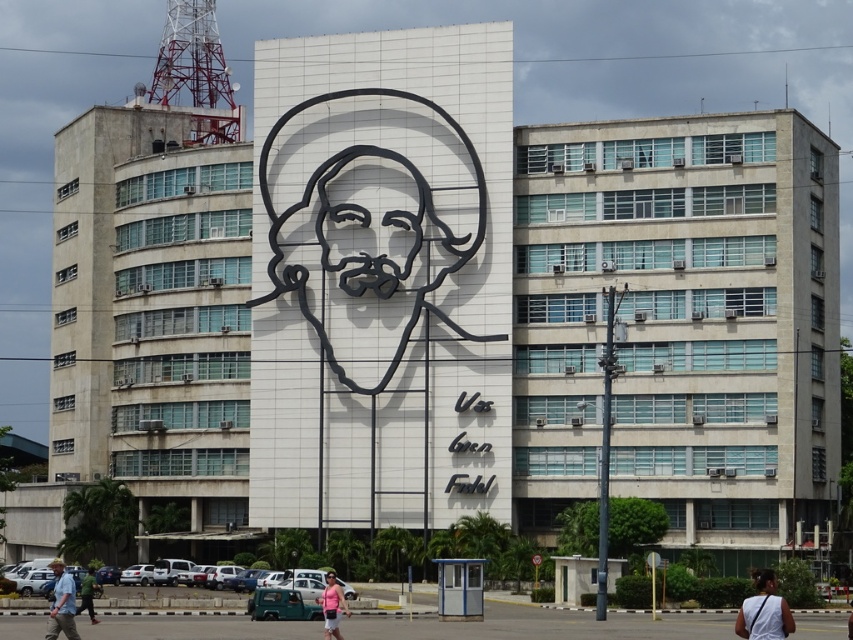
Who is more forward, (370, 266) or (84, 593)?

Point (84, 593) is in front.

Consider the image. Does black wireframe face at center come behind green fabric shirt at lower left?

Yes, it is behind green fabric shirt at lower left.

Which is behind, point (343, 202) or point (93, 618)?

The point (343, 202) is more distant.

Where is `black wireframe face at center`? This screenshot has height=640, width=853. black wireframe face at center is located at coordinates (366, 227).

Who is positioned more to the right, black outline portrait at center or white fabric bag at lower right?

white fabric bag at lower right is more to the right.

What do you see at coordinates (367, 225) in the screenshot? I see `black outline portrait at center` at bounding box center [367, 225].

What are the coordinates of `black outline portrait at center` in the screenshot? It's located at (367, 225).

Can you confirm if black matte face at center is thinner than matte black face at center?

No, black matte face at center is not thinner than matte black face at center.

Where is `black matte face at center`? The width and height of the screenshot is (853, 640). black matte face at center is located at coordinates (56, 566).